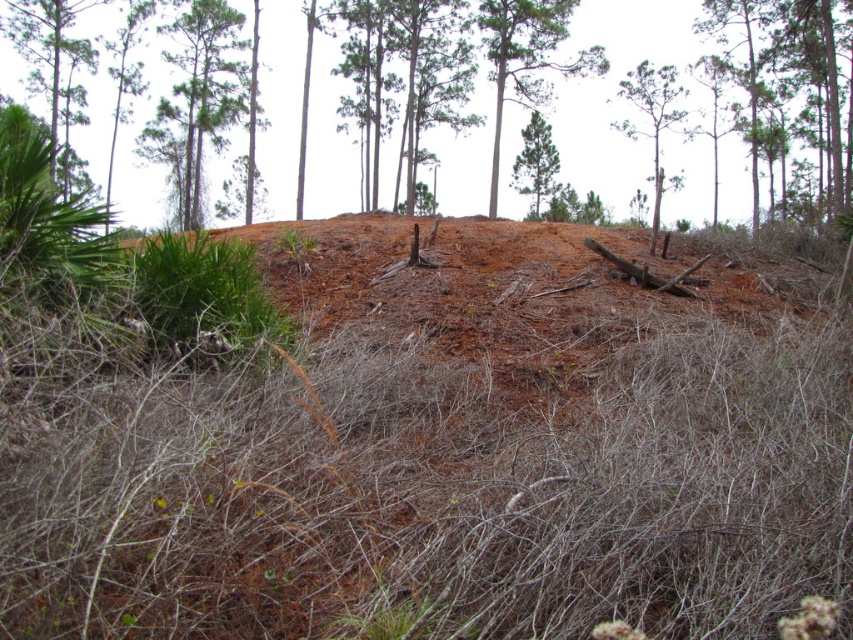
You are a hiker who has just entered the forest and sees the brown soil at upper center and the green matte tree at upper center. Which object is closer to you?

The brown soil at upper center is much taller than the green matte tree at upper center, so the brown soil at upper center is closer to you.

You are a hiker trying to navigate through the forest. You see a green leafy tree at upper left and a green matte tree at center. Which tree would you choose to climb for a better view of the surrounding area?

The green leafy tree at upper left is taller than the green matte tree at center, so you should choose the green leafy tree at upper left to climb for a better view.